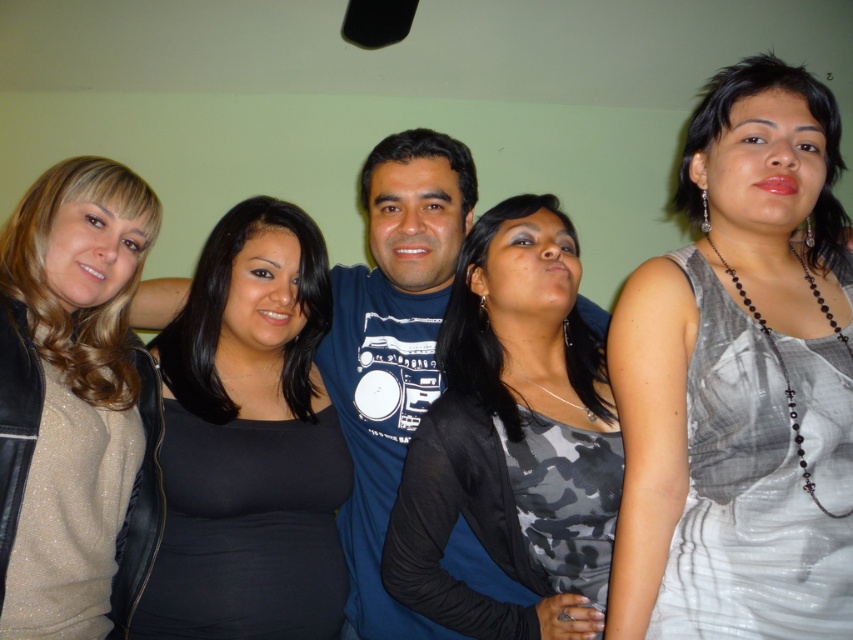
Does black matte shirt at center come in front of sparkly beige sweater at left?

No, black matte shirt at center is behind sparkly beige sweater at left.

Does black matte shirt at center have a lesser height compared to sparkly beige sweater at left?

No.

Is point (235, 268) farther from camera compared to point (3, 492)?

Yes, it is.

Image resolution: width=853 pixels, height=640 pixels. What are the coordinates of `black matte shirt at center` in the screenshot? It's located at [248, 442].

Is gray textured dress at center shorter than sparkly beige sweater at left?

Incorrect, gray textured dress at center's height does not fall short of sparkly beige sweater at left's.

Looking at this image, is gray textured dress at center bigger than sparkly beige sweater at left?

Yes.

Locate an element on the screen. The height and width of the screenshot is (640, 853). gray textured dress at center is located at coordinates (735, 369).

Find the location of a particular element. gray textured dress at center is located at coordinates (735, 369).

Can you confirm if sparkly beige sweater at left is shorter than blue cotton shirt at center?

Correct, sparkly beige sweater at left is not as tall as blue cotton shirt at center.

You are a GUI agent. You are given a task and a screenshot of the screen. Output one action in this format:
    pyautogui.click(x=<x>, y=<y>)
    Task: Click on the sparkly beige sweater at left
    The image size is (853, 640).
    Given the screenshot: What is the action you would take?
    pyautogui.click(x=68, y=394)

Measure the distance between point (x=102, y=349) and camera.

Point (x=102, y=349) is 1.28 meters away from camera.

The width and height of the screenshot is (853, 640). I want to click on sparkly beige sweater at left, so click(x=68, y=394).